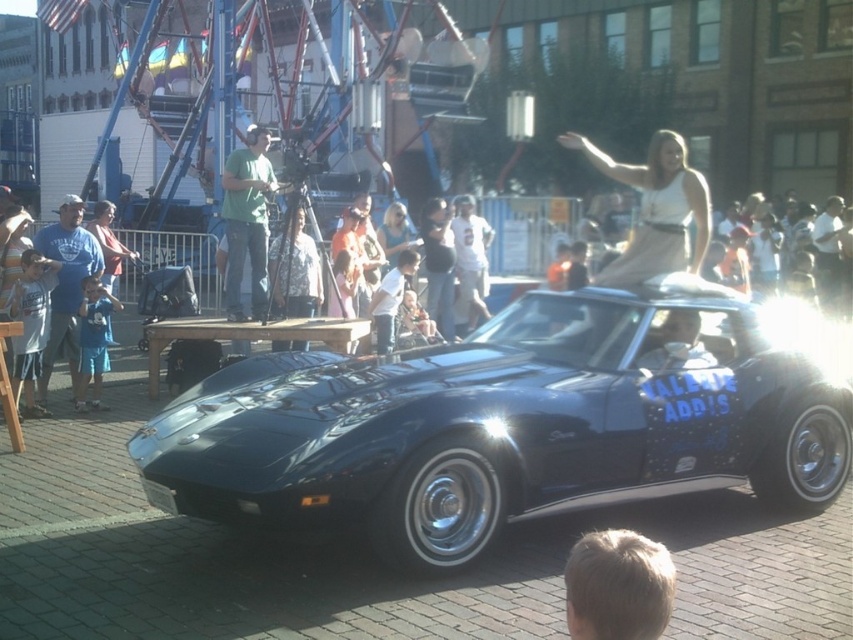
Between glossy black car at center and blue cotton shirt at lower left, which one appears on the right side from the viewer's perspective?

Positioned to the right is glossy black car at center.

Is point (253, 480) farther from viewer compared to point (91, 305)?

No.

The height and width of the screenshot is (640, 853). Describe the element at coordinates (511, 428) in the screenshot. I see `glossy black car at center` at that location.

Where is `glossy black car at center`? The image size is (853, 640). glossy black car at center is located at coordinates (511, 428).

Is green matte shirt at center below blue cotton shirt at lower left?

Actually, green matte shirt at center is above blue cotton shirt at lower left.

Can you confirm if green matte shirt at center is thinner than blue cotton shirt at lower left?

No.

Is point (235, 280) more distant than point (97, 328)?

That is True.

At what (x,y) coordinates should I click in order to perform the action: click on green matte shirt at center. Please return your answer as a coordinate pair (x, y). Image resolution: width=853 pixels, height=640 pixels. Looking at the image, I should click on (247, 221).

Which is behind, point (231, 509) or point (265, 305)?

Point (265, 305)

Which is more to the left, glossy black car at center or green matte shirt at center?

green matte shirt at center is more to the left.

This screenshot has height=640, width=853. What are the coordinates of `glossy black car at center` in the screenshot? It's located at (511, 428).

Where is `glossy black car at center`? glossy black car at center is located at coordinates (511, 428).